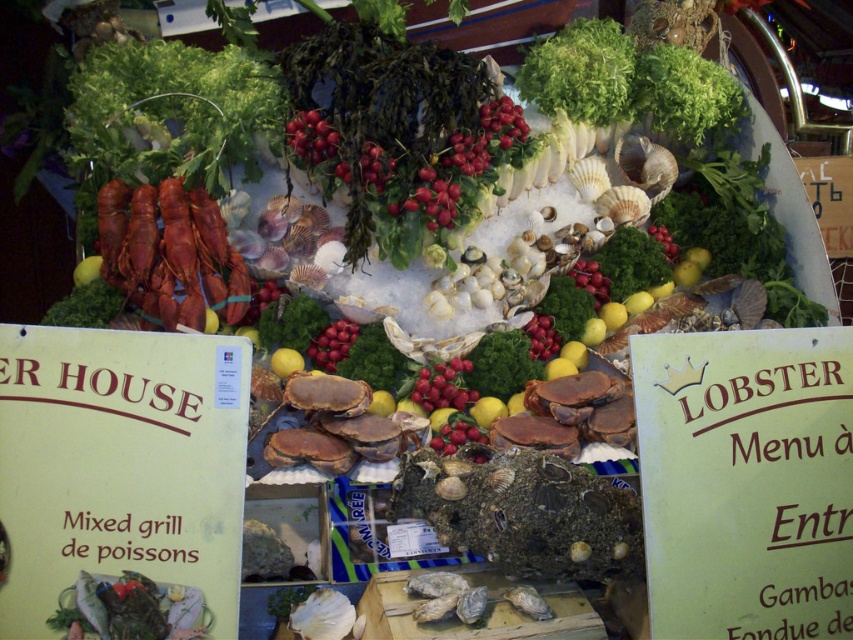
Question: Which object appears closest to the camera in this image?

Choices:
 (A) shiny red grapes at center
 (B) shiny red tomatoes at center

Answer: (A)

Question: Is shiny red tomatoes at center to the right of shiny red grapes at center from the viewer's perspective?

Choices:
 (A) no
 (B) yes

Answer: (A)

Question: Is shiny red tomatoes at center below shiny red grapes at center?

Choices:
 (A) no
 (B) yes

Answer: (A)

Question: Does shiny red tomatoes at center come in front of shiny red grapes at center?

Choices:
 (A) no
 (B) yes

Answer: (A)

Question: Among these objects, which one is nearest to the camera?

Choices:
 (A) shiny red tomatoes at center
 (B) shiny red grapes at center

Answer: (B)